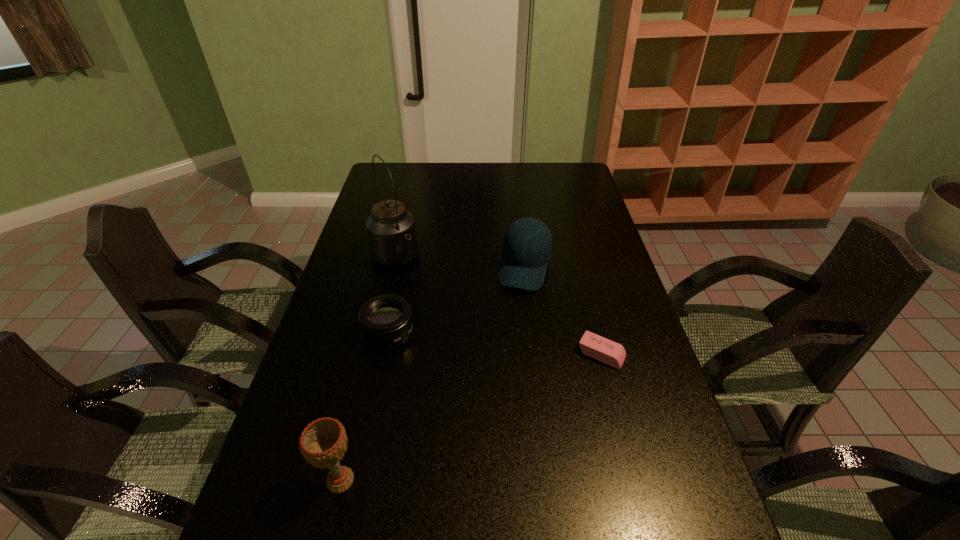
Identify the location of vacant space on the desktop that is between the nearest object and the rightmost object and is positioned spout on the tallest object. (503, 402).

This screenshot has width=960, height=540. What are the coordinates of `vacant spot on the desktop that is between the fourth shortest object and the rightmost object and is positioned on the side of the telephoto lens with brand markings and control switches` in the screenshot? It's located at (468, 419).

Where is `free space on the desktop that is between the nearest object and the shortest object and is positioned on the front-facing side of the baseball cap`? This screenshot has height=540, width=960. free space on the desktop that is between the nearest object and the shortest object and is positioned on the front-facing side of the baseball cap is located at coordinates (487, 410).